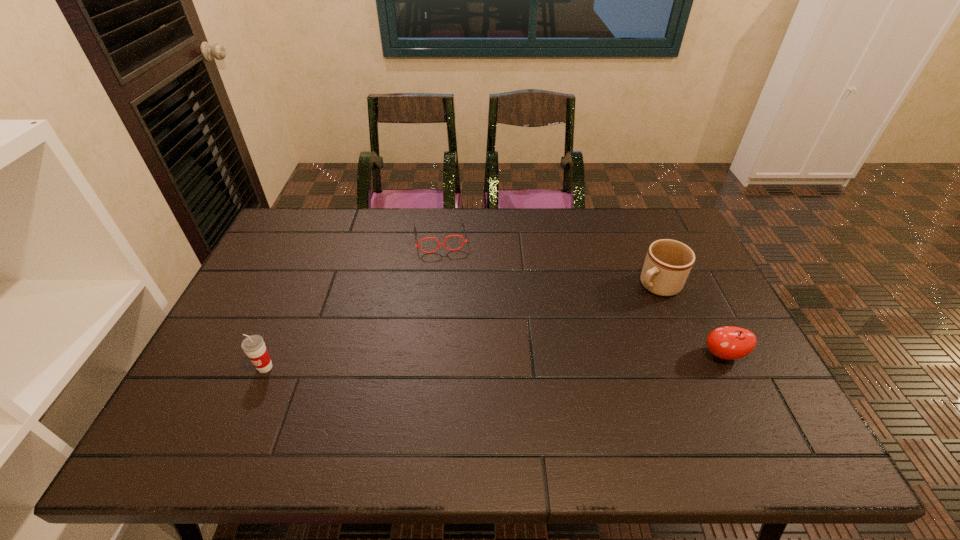
Find the location of a particular element. The image size is (960, 540). blank area located on the side of the mug with the handle is located at coordinates (617, 312).

Locate an element on the screen. The image size is (960, 540). free point located 0.070m on the side of the mug with the handle is located at coordinates (626, 306).

Identify the location of vacant region located 0.080m on the side of the mug with the handle. The image size is (960, 540). (624, 307).

Image resolution: width=960 pixels, height=540 pixels. I want to click on object located in the far edge section of the desktop, so click(x=444, y=244).

Where is `object at the left edge`? object at the left edge is located at coordinates (254, 347).

Locate an element on the screen. apple present at the right edge is located at coordinates (729, 342).

Where is `mug that is at the right edge`? The image size is (960, 540). mug that is at the right edge is located at coordinates (668, 263).

This screenshot has height=540, width=960. I want to click on vacant space at the far edge of the desktop, so click(x=616, y=215).

Find the location of a particular element. vacant area at the near edge is located at coordinates (686, 405).

You are a GUI agent. You are given a task and a screenshot of the screen. Output one action in this format:
    pyautogui.click(x=<x>, y=<y>)
    Task: Click on the vacant area at the left edge of the desktop
    Image resolution: width=960 pixels, height=540 pixels.
    Given the screenshot: What is the action you would take?
    pyautogui.click(x=255, y=318)